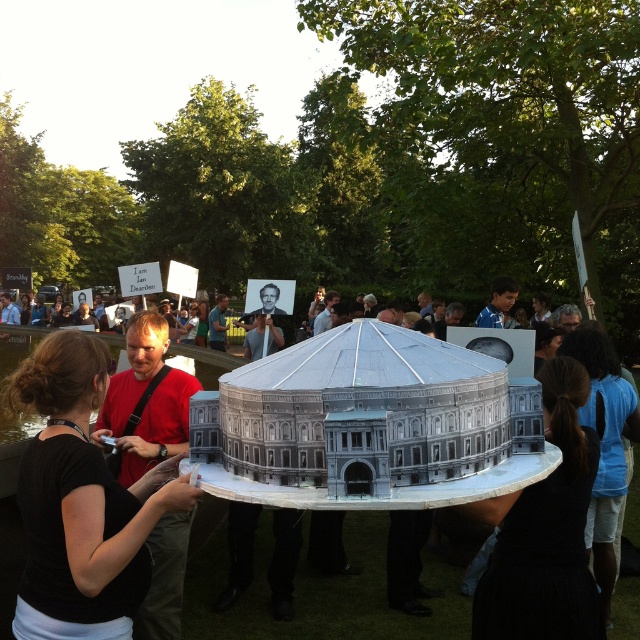
Question: Is matte gray building at center further to the viewer compared to black fabric dress at lower right?

Choices:
 (A) yes
 (B) no

Answer: (A)

Question: Which object appears farthest from the camera in this image?

Choices:
 (A) matte gray building at center
 (B) black fabric ponytail at lower right

Answer: (B)

Question: Which object appears farthest from the camera in this image?

Choices:
 (A) black fabric ponytail at lower right
 (B) matte gray building at center
 (C) black fabric dress at lower right
 (D) black matte shirt at center

Answer: (A)

Question: Estimate the real-world distances between objects in this image. Which object is closer to the black fabric ponytail at lower right?

Choices:
 (A) black matte shirt at center
 (B) matte gray building at center
 (C) black fabric dress at lower right

Answer: (C)

Question: Can you confirm if matte gray building at center is positioned above black fabric ponytail at lower right?

Choices:
 (A) yes
 (B) no

Answer: (A)

Question: Can you confirm if black matte shirt at center is wider than black fabric ponytail at lower right?

Choices:
 (A) no
 (B) yes

Answer: (B)